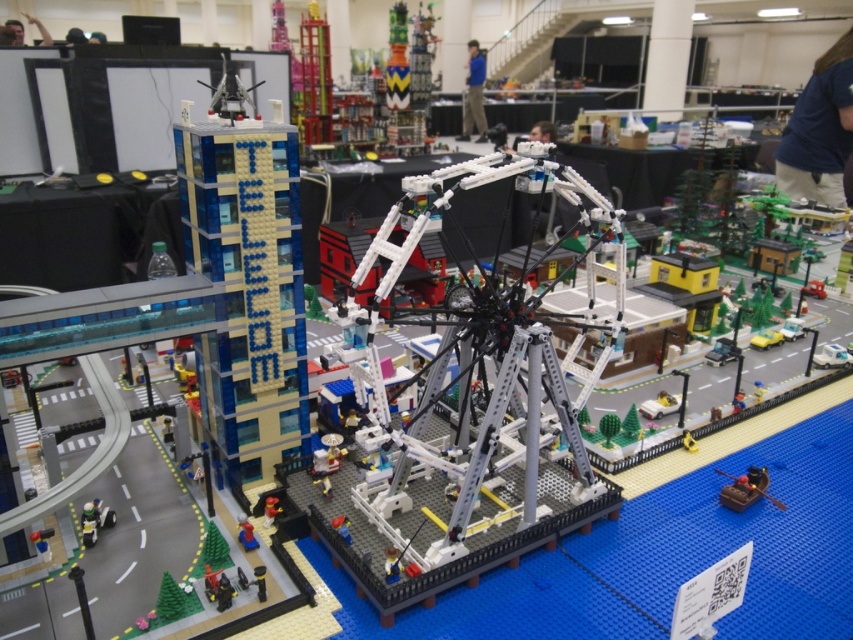
Is point (241, 541) closer to viewer compared to point (263, 513)?

Yes, point (241, 541) is in front of point (263, 513).

Is translucent plastic minifigure at center thinner than brick red figure at center?

Incorrect, translucent plastic minifigure at center's width is not less than brick red figure at center's.

Is point (248, 544) positioned behind point (273, 506)?

No, it is in front of (273, 506).

Image resolution: width=853 pixels, height=640 pixels. I want to click on translucent plastic minifigure at center, so coord(247,532).

Based on the photo, can you confirm if matte black minifigure at lower left is thinner than white plastic car at center?

Yes, matte black minifigure at lower left is thinner than white plastic car at center.

Image resolution: width=853 pixels, height=640 pixels. Describe the element at coordinates (94, 520) in the screenshot. I see `matte black minifigure at lower left` at that location.

In order to click on matte black minifigure at lower left in this screenshot , I will do `click(94, 520)`.

The width and height of the screenshot is (853, 640). I want to click on matte black minifigure at lower left, so click(x=94, y=520).

Who is positioned more to the left, transparent plastic ferris wheel at center or matte brown canoe at lower right?

transparent plastic ferris wheel at center is more to the left.

What do you see at coordinates (469, 406) in the screenshot? I see `transparent plastic ferris wheel at center` at bounding box center [469, 406].

Where is `transparent plastic ferris wheel at center`? This screenshot has width=853, height=640. transparent plastic ferris wheel at center is located at coordinates (469, 406).